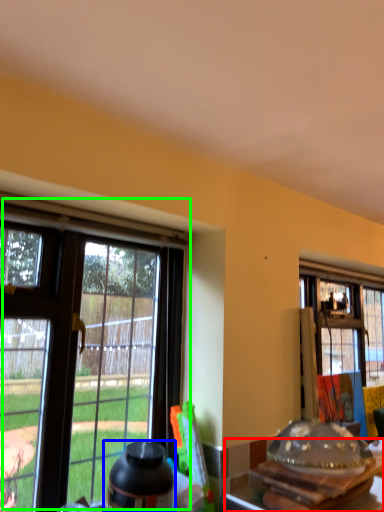
Question: Estimate the real-world distances between objects in this image. Which object is closer to kitchen & dining room table (highlighted by a red box), bottle (highlighted by a blue box) or window (highlighted by a green box)?

Choices:
 (A) bottle
 (B) window

Answer: (A)